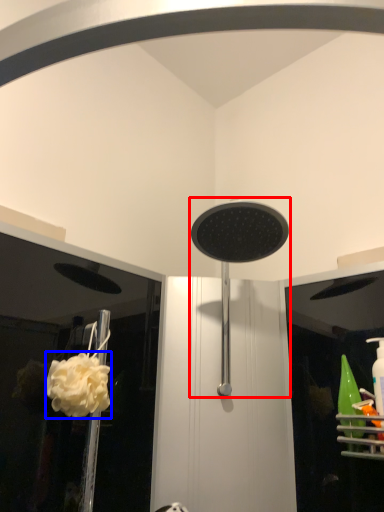
Question: Which point is closer to the camera, shower (highlighted by a red box) or flower (highlighted by a blue box)?

Choices:
 (A) shower
 (B) flower

Answer: (A)